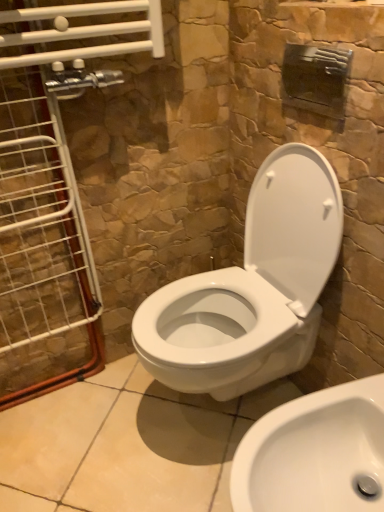
Question: Is clear glass door at left positioned with its back to white glossy toilet at center?

Choices:
 (A) yes
 (B) no

Answer: (B)

Question: Could you tell me if clear glass door at left is facing white glossy toilet at center?

Choices:
 (A) yes
 (B) no

Answer: (B)

Question: Considering the relative sizes of clear glass door at left and white glossy toilet at center in the image provided, is clear glass door at left shorter than white glossy toilet at center?

Choices:
 (A) no
 (B) yes

Answer: (A)

Question: Is clear glass door at left in contact with white glossy toilet at center?

Choices:
 (A) yes
 (B) no

Answer: (B)

Question: From the image's perspective, is clear glass door at left beneath white glossy toilet at center?

Choices:
 (A) no
 (B) yes

Answer: (A)

Question: Considering the relative positions of clear glass door at left and white glossy toilet at center in the image provided, is clear glass door at left to the right of white glossy toilet at center from the viewer's perspective?

Choices:
 (A) no
 (B) yes

Answer: (A)

Question: Does white glossy sink at lower right turn towards clear glass door at left?

Choices:
 (A) no
 (B) yes

Answer: (A)

Question: Considering the relative sizes of white glossy sink at lower right and clear glass door at left in the image provided, is white glossy sink at lower right bigger than clear glass door at left?

Choices:
 (A) yes
 (B) no

Answer: (A)

Question: Does white glossy sink at lower right have a greater height compared to clear glass door at left?

Choices:
 (A) no
 (B) yes

Answer: (A)

Question: Can you confirm if white glossy sink at lower right is wider than clear glass door at left?

Choices:
 (A) yes
 (B) no

Answer: (A)

Question: Would you say clear glass door at left is part of white glossy sink at lower right's contents?

Choices:
 (A) no
 (B) yes

Answer: (A)

Question: Is white glossy sink at lower right to the right of clear glass door at left from the viewer's perspective?

Choices:
 (A) no
 (B) yes

Answer: (B)

Question: Is white glossy toilet at center smaller than white glossy sink at lower right?

Choices:
 (A) yes
 (B) no

Answer: (B)